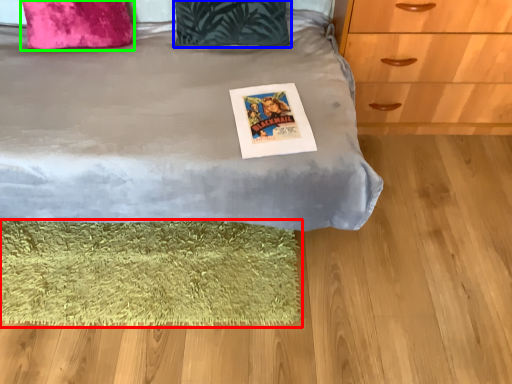
Question: Which is farther away from mat (highlighted by a red box)? pillow (highlighted by a blue box) or pillow (highlighted by a green box)?

Choices:
 (A) pillow
 (B) pillow

Answer: (B)